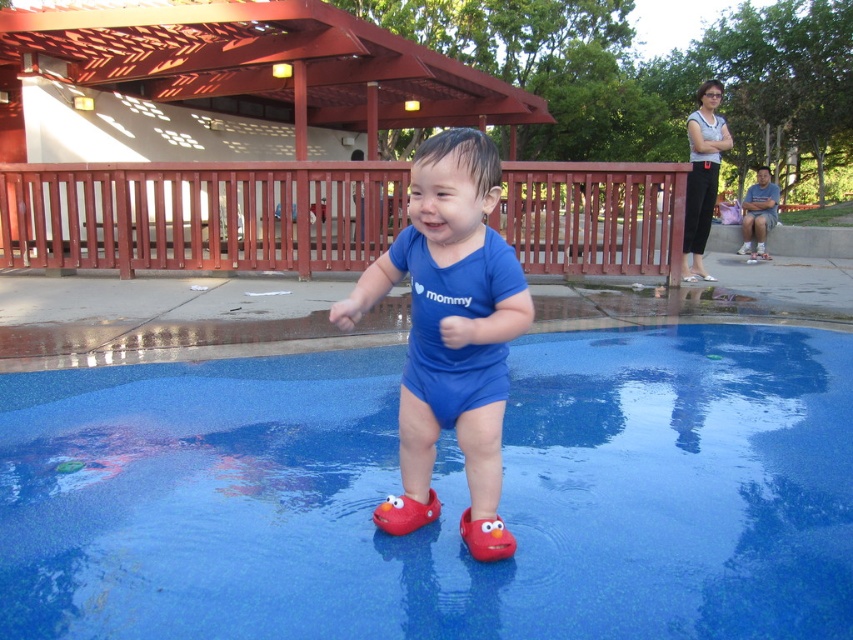
Does point (763, 218) come closer to viewer compared to point (511, 536)?

No, (763, 218) is behind (511, 536).

Can you confirm if blue cotton shirt at center is bigger than rubber elmo shoe at center?

Yes, blue cotton shirt at center is bigger than rubber elmo shoe at center.

The width and height of the screenshot is (853, 640). What do you see at coordinates (758, 214) in the screenshot? I see `blue cotton shirt at center` at bounding box center [758, 214].

I want to click on blue cotton shirt at center, so click(x=758, y=214).

Between blue textured pool at center and blue cotton shirt at center, which one has less height?

blue textured pool at center

Does point (316, 500) lie behind point (764, 170)?

No, it is not.

Locate an element on the screen. The image size is (853, 640). blue textured pool at center is located at coordinates (438, 496).

Does point (437, 337) lie in front of point (756, 182)?

Yes, it is in front of point (756, 182).

This screenshot has height=640, width=853. What are the coordinates of `blue matte onesie at center` in the screenshot? It's located at (451, 312).